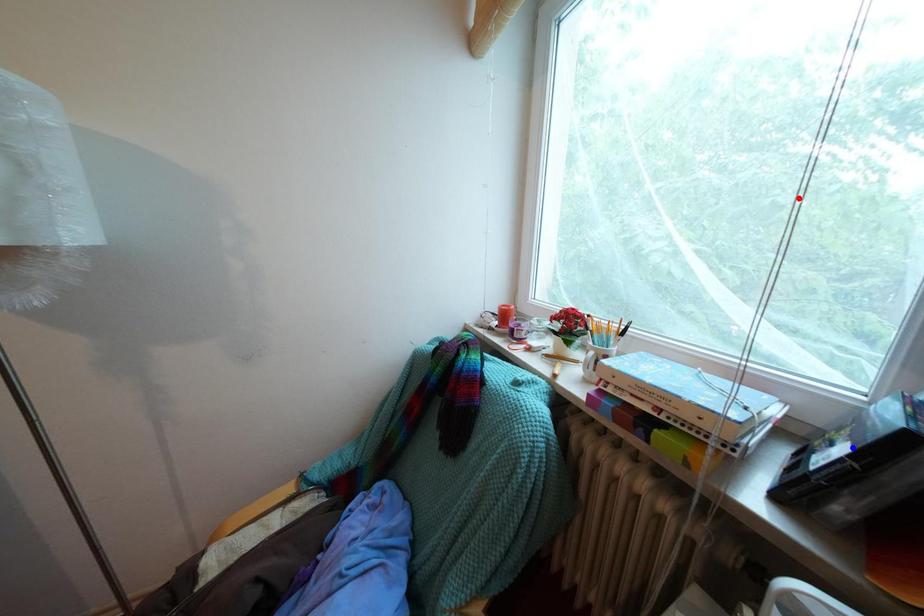
Question: Which of the two points in the image is closer to the camera?

Choices:
 (A) Blue point is closer.
 (B) Red point is closer.

Answer: (A)